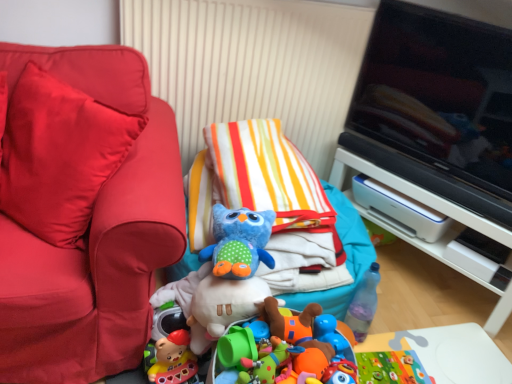
Question: In the image, is blue plush owl at center, which is the first toy from front to back, positioned in front of or behind black glossy television at upper right?

Choices:
 (A) front
 (B) behind

Answer: (A)

Question: Does point (252, 266) appear closer or farther from the camera than point (492, 79)?

Choices:
 (A) closer
 (B) farther

Answer: (A)

Question: Which of these objects is positioned closest to the blue plush owl at center, placed as the 2th toy when sorted from back to front?

Choices:
 (A) matte red couch at left, placed as the second furniture when sorted from right to left
 (B) black glossy television at upper right
 (C) white plastic printer at right, the second furniture positioned from the left
 (D) blue rubber duck at center, acting as the first toy starting from the bottom

Answer: (D)

Question: Which of these objects is positioned closest to the blue rubber duck at center, placed as the 2th toy when sorted from left to right?

Choices:
 (A) matte red couch at left, placed as the second furniture when sorted from right to left
 (B) white plastic printer at right, positioned as the 2th furniture in front-to-back order
 (C) blue plush owl at center, the 2th toy positioned from the bottom
 (D) black glossy television at upper right

Answer: (C)